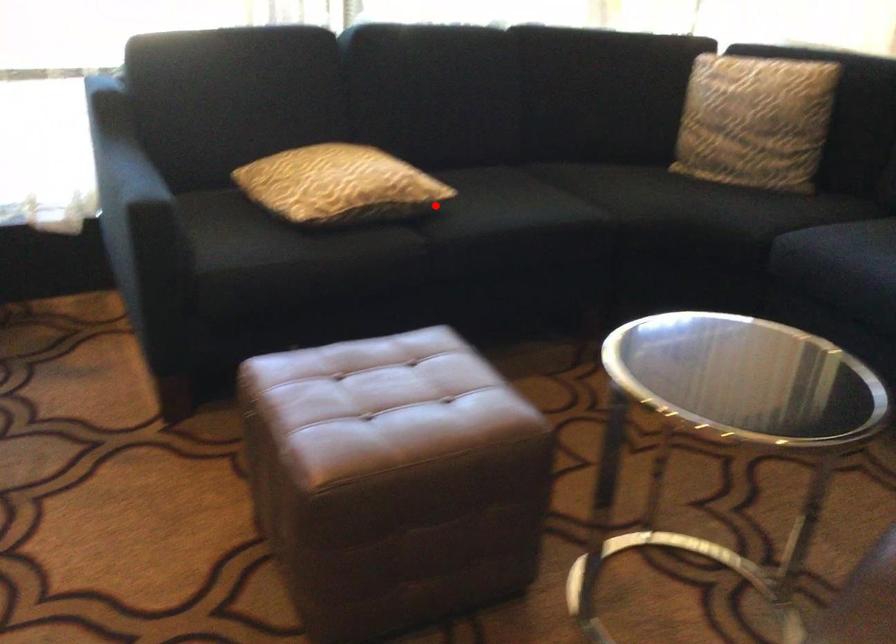
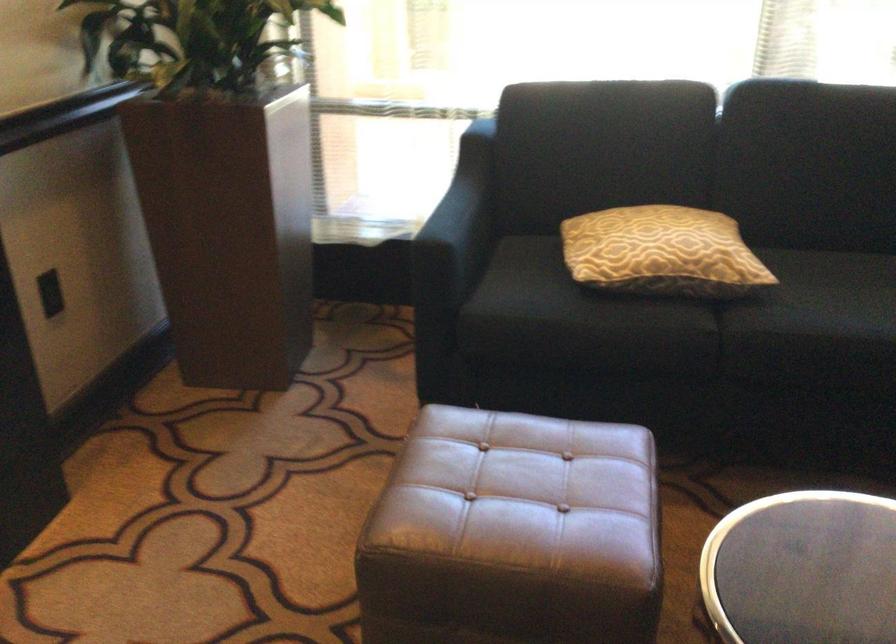
Locate, in the second image, the point that corresponds to the highlighted location in the first image.

(752, 289)